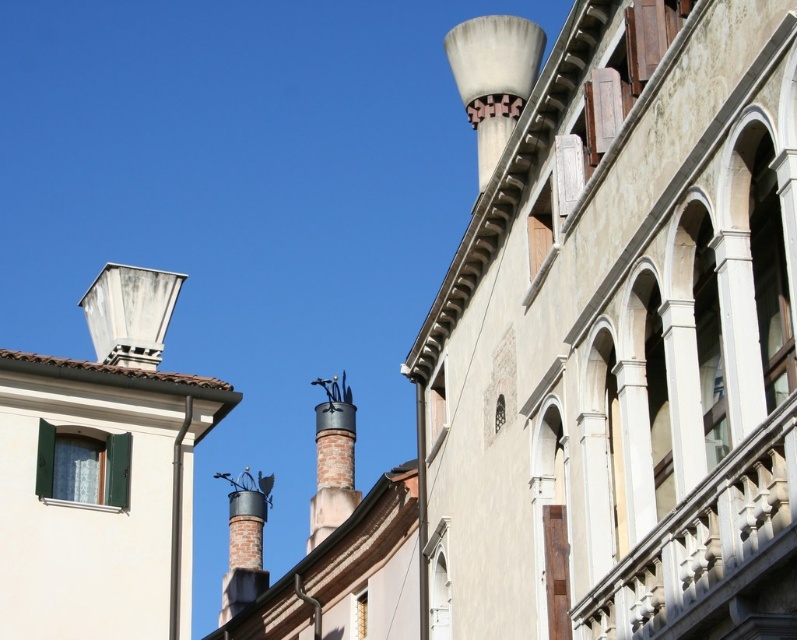
You are an architect inspecting the facade of this historic building. You need to determine the relative positions of the white concrete chimney at upper left and the polished metal chimney at center. Which chimney is positioned to the left of the other?

The white concrete chimney at upper left is to the left of the polished metal chimney at center, so the white concrete chimney at upper left is positioned to the left of the polished metal chimney at center.

You are an architect inspecting the building facade. You need to install a new decorative element on the smaller chimney. Which chimney should you choose between the white matte chimney at upper right and the polished metal chimney at center?

The polished metal chimney at center is smaller, so you should choose the polished metal chimney at center to install the new decorative element.

You are standing in front of the historic building and want to take a photo. There are two points marked on the building facade. The first point is at coordinates point (x=507, y=90) and the second is at point (x=332, y=522). Which point will appear larger in your photo?

Point (x=507, y=90) is closer to the camera than point (x=332, y=522), so it will appear larger in the photo.